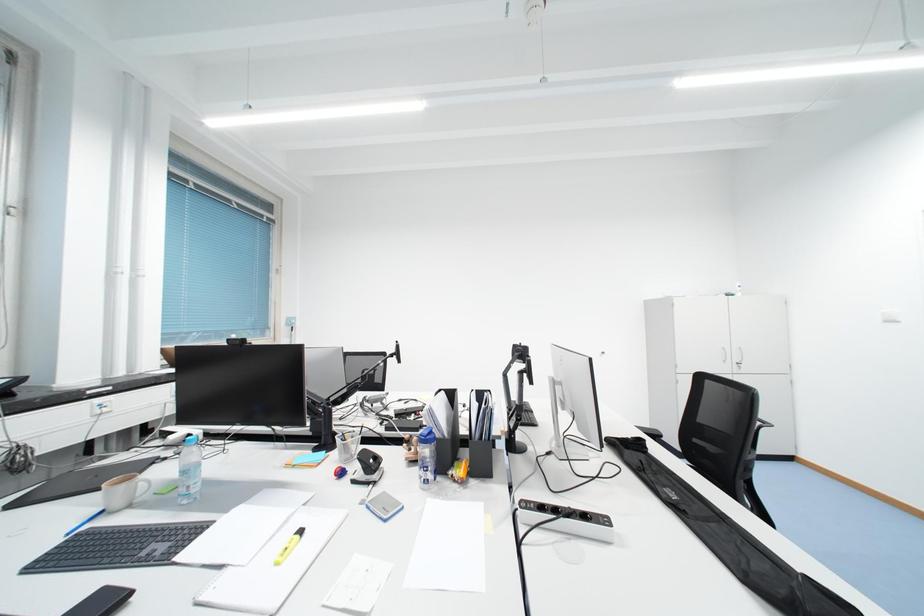
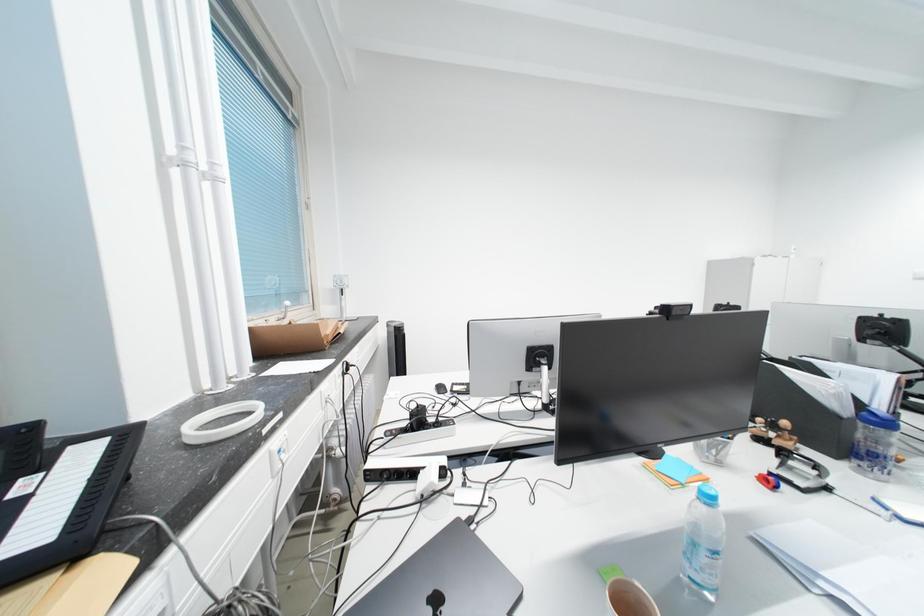
In a continuous first-person perspective shot, in which direction is the camera moving?

The cameraman moved toward left, forward.